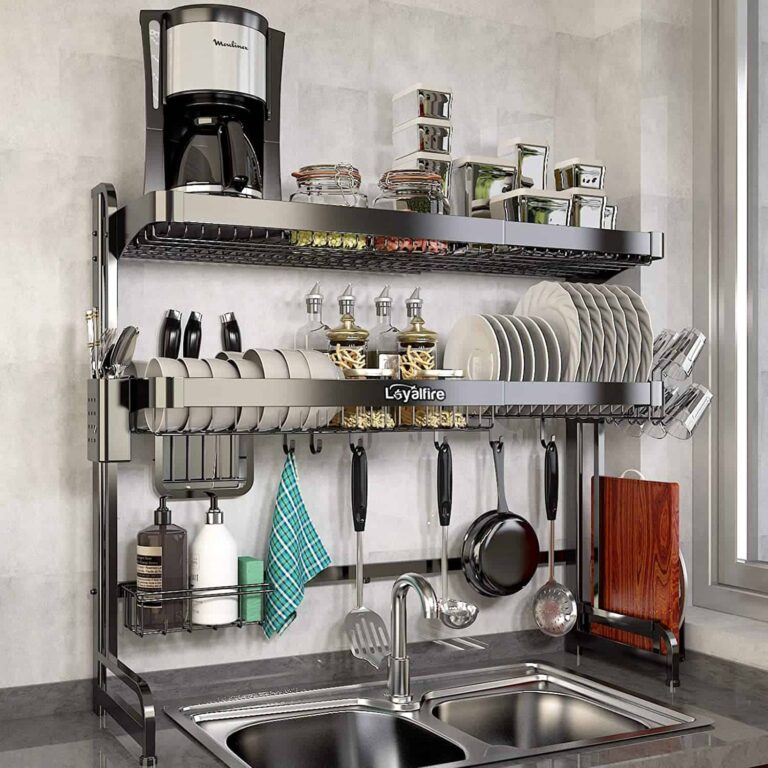
Image resolution: width=768 pixels, height=768 pixels. I want to click on bowl, so click(323, 372), click(296, 372), click(276, 369), click(250, 369), click(217, 372), click(192, 372), click(161, 372), click(137, 372).